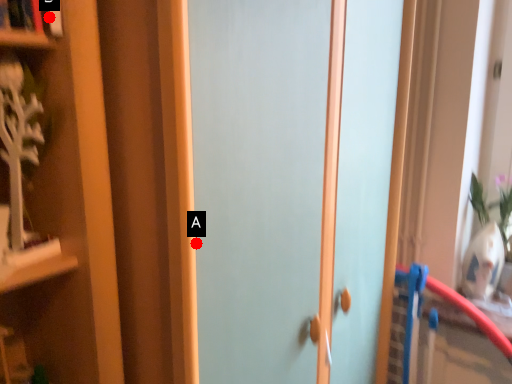
Question: Two points are circled on the image, labeled by A and B beside each circle. Which point is further to the camera?

Choices:
 (A) A is further
 (B) B is further

Answer: (A)